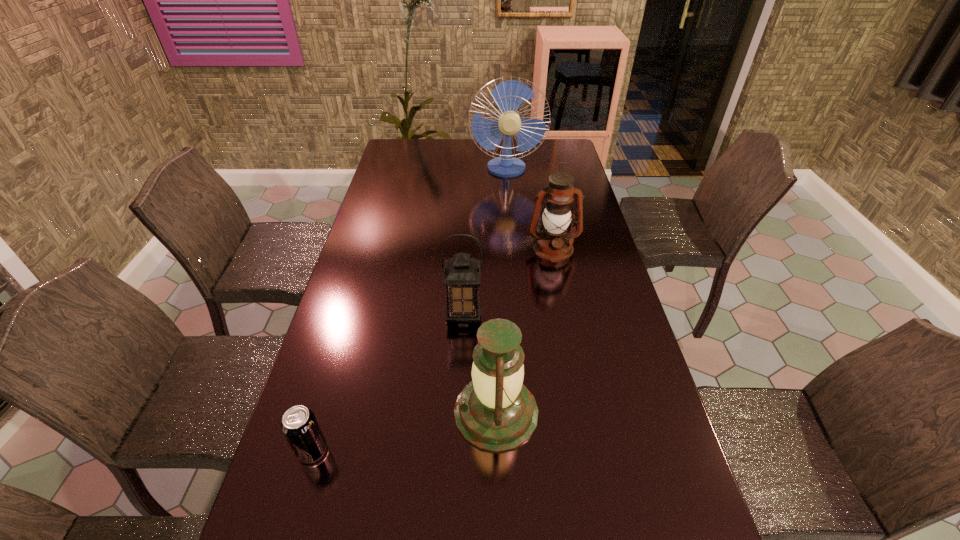
You are a GUI agent. You are given a task and a screenshot of the screen. Output one action in this format:
    pyautogui.click(x=<x>, y=<y>)
    Task: Click on the blank region between the second farthest lantern and the fan
    This screenshot has height=540, width=960.
    Given the screenshot: What is the action you would take?
    pyautogui.click(x=485, y=243)

Identify the location of free space between the nearest lantern and the fan. This screenshot has width=960, height=540. (501, 291).

Locate an element on the screen. The width and height of the screenshot is (960, 540). free space that is in between the tallest object and the nearest lantern is located at coordinates (501, 291).

Locate an element on the screen. the closest object to the fan is located at coordinates pyautogui.click(x=553, y=243).

Point out which object is positioned as the second nearest to the farthest lantern. Please provide its 2D coordinates. Your answer should be formatted as a tuple, i.e. [(x, y)], where the tuple contains the x and y coordinates of a point satisfying the conditions above.

[(509, 95)]

Identify the location of the closest lantern to the second farthest object. (462, 274).

Identify which lantern is located as the second nearest to the farthest lantern. Please provide its 2D coordinates. Your answer should be formatted as a tuple, i.e. [(x, y)], where the tuple contains the x and y coordinates of a point satisfying the conditions above.

[(495, 412)]

This screenshot has height=540, width=960. What are the coordinates of `vacant area in the image that satisfies the following two spatial constraints: 1. with the light compartment facing forward on the nearest lantern; 2. on the front side of the soda can` in the screenshot? It's located at pos(497,450).